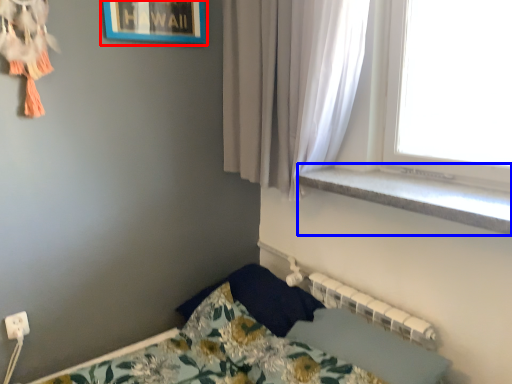
Question: Which of the following is the closest to the observer, picture frame (highlighted by a red box) or window sill (highlighted by a blue box)?

Choices:
 (A) picture frame
 (B) window sill

Answer: (B)